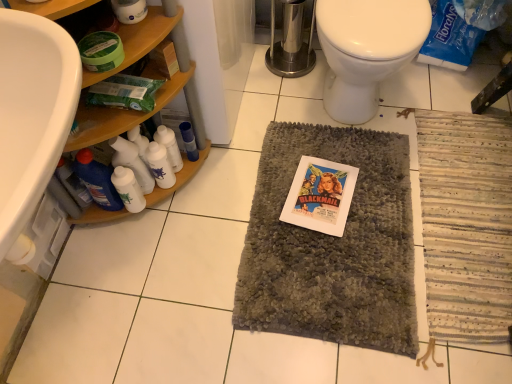
Image resolution: width=512 pixels, height=384 pixels. I want to click on spots to the right of matte paper comic book at center, so click(384, 192).